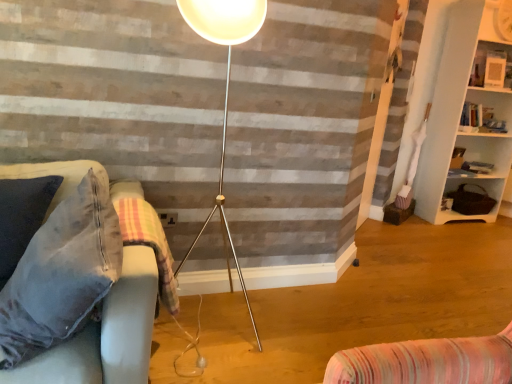
What is the approximate height of white matte bookshelf at right, the second shelf from the bottom?

2.06 meters.

What is the approximate width of white matte bookshelf at right, the second shelf from the bottom?

It is 17.08 inches.

What do you see at coordinates (492, 65) in the screenshot?
I see `white glossy picture frame at upper right, which is counted as the 1th shelf, starting from the top` at bounding box center [492, 65].

At what (x,y) coordinates should I click in order to perform the action: click on white matte bookshelf at right, the second shelf from the bottom. Please return your answer as a coordinate pair (x, y). Looking at the image, I should click on (460, 117).

Is plaid fabric blanket at lower left wider than white matte bookshelf at right, the second shelf from the bottom?

No.

Which object is positioned more to the left, plaid fabric blanket at lower left or white matte bookshelf at right, the second shelf from the bottom?

Positioned to the left is plaid fabric blanket at lower left.

Is white matte bookshelf at right, the 2th shelf from the top, located within plaid fabric blanket at lower left?

That's incorrect, white matte bookshelf at right, the 2th shelf from the top, is not inside plaid fabric blanket at lower left.

Is wooden textured basket at right, which ranks as the 3th shelf in top-to-bottom order, oriented towards white glossy picture frame at upper right, which is the 3th shelf from bottom to top?

No, wooden textured basket at right, which ranks as the 3th shelf in top-to-bottom order, is not turned towards white glossy picture frame at upper right, which is the 3th shelf from bottom to top.

Is wooden textured basket at right, which ranks as the 3th shelf in top-to-bottom order, positioned far away from white glossy picture frame at upper right, which is the 3th shelf from bottom to top?

wooden textured basket at right, which ranks as the 3th shelf in top-to-bottom order, is positioned a significant distance from white glossy picture frame at upper right, which is the 3th shelf from bottom to top.

From the image's perspective, which one is positioned higher, wooden textured basket at right, positioned as the 1th shelf in bottom-to-top order, or white glossy picture frame at upper right, which is counted as the 1th shelf, starting from the top?

white glossy picture frame at upper right, which is counted as the 1th shelf, starting from the top, from the image's perspective.

Is wooden textured basket at right, which ranks as the 3th shelf in top-to-bottom order, not within white glossy picture frame at upper right, which is the 3th shelf from bottom to top?

Yes, wooden textured basket at right, which ranks as the 3th shelf in top-to-bottom order, is located beyond the bounds of white glossy picture frame at upper right, which is the 3th shelf from bottom to top.

Does velvet fabric couch at left touch plaid fabric blanket at lower left?

No, velvet fabric couch at left is not with plaid fabric blanket at lower left.

Does velvet fabric couch at left lie behind plaid fabric blanket at lower left?

No, velvet fabric couch at left is in front of plaid fabric blanket at lower left.

Would you say plaid fabric blanket at lower left is part of velvet fabric couch at left's contents?

That's incorrect, plaid fabric blanket at lower left is not inside velvet fabric couch at left.

Does velvet fabric couch at left turn towards plaid fabric blanket at lower left?

Yes, velvet fabric couch at left is aimed at plaid fabric blanket at lower left.

Which is more to the right, velvet fabric couch at left or white matte bookshelf at right, the second shelf from the bottom?

Positioned to the right is white matte bookshelf at right, the second shelf from the bottom.

From a real-world perspective, does velvet fabric couch at left stand above white matte bookshelf at right, the 2th shelf from the top?

No, from a real-world perspective, velvet fabric couch at left is not above white matte bookshelf at right, the 2th shelf from the top.

Looking at the image, does velvet fabric couch at left seem bigger or smaller compared to white matte bookshelf at right, the 2th shelf from the top?

velvet fabric couch at left is smaller than white matte bookshelf at right, the 2th shelf from the top.

Between velvet fabric couch at left and white matte bookshelf at right, the second shelf from the bottom, which one has less height?

Standing shorter between the two is velvet fabric couch at left.

From a real-world perspective, is white glossy picture frame at upper right, which is the 3th shelf from bottom to top, positioned over wooden textured basket at right, which ranks as the 3th shelf in top-to-bottom order, based on gravity?

Correct, in the physical world, white glossy picture frame at upper right, which is the 3th shelf from bottom to top, is higher than wooden textured basket at right, which ranks as the 3th shelf in top-to-bottom order.

Measure the distance between white glossy picture frame at upper right, which is the 3th shelf from bottom to top, and wooden textured basket at right, which ranks as the 3th shelf in top-to-bottom order.

white glossy picture frame at upper right, which is the 3th shelf from bottom to top, and wooden textured basket at right, which ranks as the 3th shelf in top-to-bottom order, are 1.14 meters apart from each other.

Which is more to the right, white glossy picture frame at upper right, which is the 3th shelf from bottom to top, or wooden textured basket at right, which ranks as the 3th shelf in top-to-bottom order?

white glossy picture frame at upper right, which is the 3th shelf from bottom to top, is more to the right.

From the picture: From a real-world perspective, is plaid fabric blanket at lower left positioned under velvet fabric couch at left based on gravity?

Yes, from a real-world perspective, plaid fabric blanket at lower left is beneath velvet fabric couch at left.

In terms of height, does plaid fabric blanket at lower left look taller or shorter compared to velvet fabric couch at left?

Considering their sizes, plaid fabric blanket at lower left has less height than velvet fabric couch at left.

Is plaid fabric blanket at lower left facing away from velvet fabric couch at left?

Yes.

How much distance is there between plaid fabric blanket at lower left and velvet fabric couch at left?

plaid fabric blanket at lower left is 7.90 inches away from velvet fabric couch at left.

Which point is more distant from viewer, [106,296] or [478,55]?

Point [478,55]

From a real-world perspective, is velvet fabric couch at left positioned under white glossy picture frame at upper right, which is counted as the 1th shelf, starting from the top, based on gravity?

Yes, from a real-world perspective, velvet fabric couch at left is under white glossy picture frame at upper right, which is counted as the 1th shelf, starting from the top.

Find the location of a particular element. The width and height of the screenshot is (512, 384). blanket in front of the white matte bookshelf at right, the 2th shelf from the top is located at coordinates (149, 243).

Locate an element on the screen. The width and height of the screenshot is (512, 384). shelf that is the 2nd one below the white glossy picture frame at upper right, which is the 3th shelf from bottom to top (from a real-world perspective) is located at coordinates (470, 189).

From the image, which object appears to be farther from white matte bookshelf at right, the second shelf from the bottom, plaid fabric blanket at lower left or white glossy picture frame at upper right, which is counted as the 1th shelf, starting from the top?

Among the two, plaid fabric blanket at lower left is located further to white matte bookshelf at right, the second shelf from the bottom.

Considering their positions, is white matte bookshelf at right, the second shelf from the bottom, positioned further to plaid fabric blanket at lower left than velvet fabric couch at left?

Among the two, white matte bookshelf at right, the second shelf from the bottom, is located further to plaid fabric blanket at lower left.

Which object lies nearer to the anchor point velvet fabric couch at left, plaid fabric blanket at lower left or white matte bookshelf at right, the second shelf from the bottom?

Based on the image, plaid fabric blanket at lower left appears to be nearer to velvet fabric couch at left.

Based on their spatial positions, is velvet fabric couch at left or plaid fabric blanket at lower left further from wooden textured basket at right, positioned as the 1th shelf in bottom-to-top order?

velvet fabric couch at left.

From the image, which object appears to be farther from velvet fabric couch at left, plaid fabric blanket at lower left or wooden textured basket at right, positioned as the 1th shelf in bottom-to-top order?

wooden textured basket at right, positioned as the 1th shelf in bottom-to-top order, is positioned further to the anchor velvet fabric couch at left.

Considering their positions, is white glossy picture frame at upper right, which is the 3th shelf from bottom to top, positioned closer to velvet fabric couch at left than plaid fabric blanket at lower left?

The object closer to velvet fabric couch at left is plaid fabric blanket at lower left.

When comparing their distances from plaid fabric blanket at lower left, does wooden textured basket at right, which ranks as the 3th shelf in top-to-bottom order, or white glossy picture frame at upper right, which is counted as the 1th shelf, starting from the top, seem closer?

Based on the image, wooden textured basket at right, which ranks as the 3th shelf in top-to-bottom order, appears to be nearer to plaid fabric blanket at lower left.

From the image, which object appears to be nearer to wooden textured basket at right, positioned as the 1th shelf in bottom-to-top order, white glossy picture frame at upper right, which is counted as the 1th shelf, starting from the top, or white matte bookshelf at right, the 2th shelf from the top?

Among the two, white matte bookshelf at right, the 2th shelf from the top, is located nearer to wooden textured basket at right, positioned as the 1th shelf in bottom-to-top order.

The height and width of the screenshot is (384, 512). Find the location of `shelf situated between plaid fabric blanket at lower left and wooden textured basket at right, positioned as the 1th shelf in bottom-to-top order, from left to right`. shelf situated between plaid fabric blanket at lower left and wooden textured basket at right, positioned as the 1th shelf in bottom-to-top order, from left to right is located at coordinates (460, 117).

Image resolution: width=512 pixels, height=384 pixels. In order to click on blanket located between velvet fabric couch at left and wooden textured basket at right, positioned as the 1th shelf in bottom-to-top order, in the depth direction in this screenshot , I will do tap(149, 243).

Where is `blanket between velvet fabric couch at left and white glossy picture frame at upper right, which is the 3th shelf from bottom to top, in the horizontal direction`? blanket between velvet fabric couch at left and white glossy picture frame at upper right, which is the 3th shelf from bottom to top, in the horizontal direction is located at coordinates (149, 243).

The width and height of the screenshot is (512, 384). Find the location of `shelf between white glossy picture frame at upper right, which is the 3th shelf from bottom to top, and wooden textured basket at right, positioned as the 1th shelf in bottom-to-top order, vertically`. shelf between white glossy picture frame at upper right, which is the 3th shelf from bottom to top, and wooden textured basket at right, positioned as the 1th shelf in bottom-to-top order, vertically is located at coordinates (460, 117).